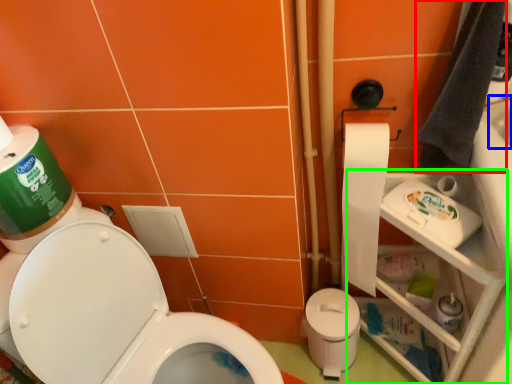
Question: Which object is the farthest from hand towel (highlighted by a red box)? Choose among these: sink (highlighted by a blue box) or shelf (highlighted by a green box).

Choices:
 (A) sink
 (B) shelf

Answer: (B)